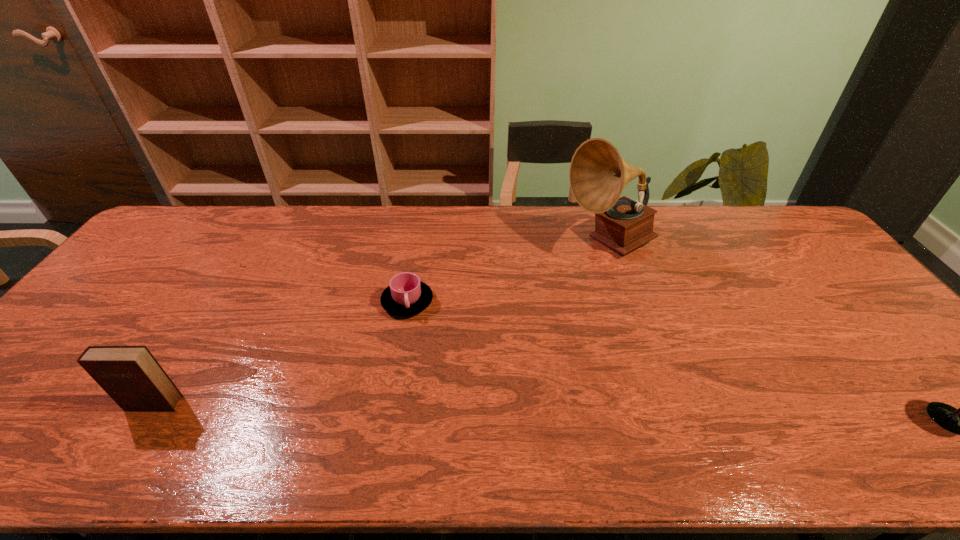
This screenshot has height=540, width=960. In order to click on vacant space on the desktop that is between the leftmost object and the rightmost object and is positioned on the side with the handle of the second object from left to right in this screenshot , I will do `click(468, 410)`.

This screenshot has width=960, height=540. I want to click on free space on the desktop that is between the diary and the rightmost object and is positioned on the horn of the farthest object, so click(x=516, y=410).